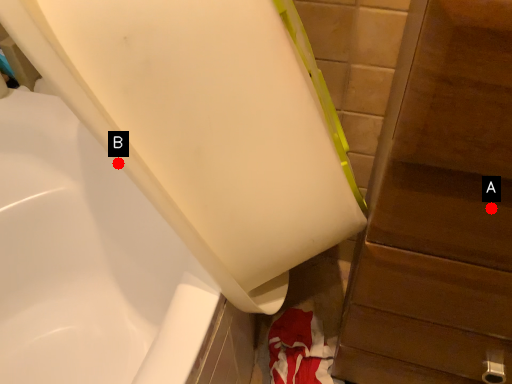
Question: Two points are circled on the image, labeled by A and B beside each circle. Which of the following is the farthest from the observer?

Choices:
 (A) A is further
 (B) B is further

Answer: (A)